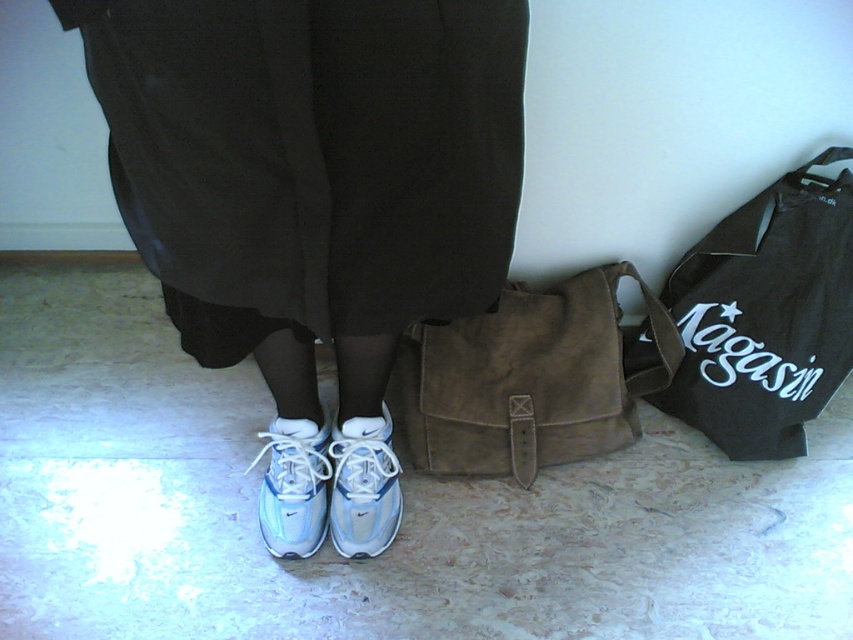
You are a delivery robot trying to navigate around the person in the image. You need to move from the starting point at point (x=305, y=157) to the destination point at (x=809, y=392). According to the scene, will you have to move forward or backward to reach the destination?

Point (x=305, y=157) is in front of point (x=809, y=392). Therefore, to reach the destination at point (x=809, y=392) from the starting point at (x=305, y=157), you will need to move backward since the destination is behind your current position.

You are trying to decide which pair of shoes to take for a walk. You have a white suede sneakers at center and a white suede shoe at center. Which one has a wider base?

The white suede sneakers at center is wider than the white suede shoe at center according to the description.